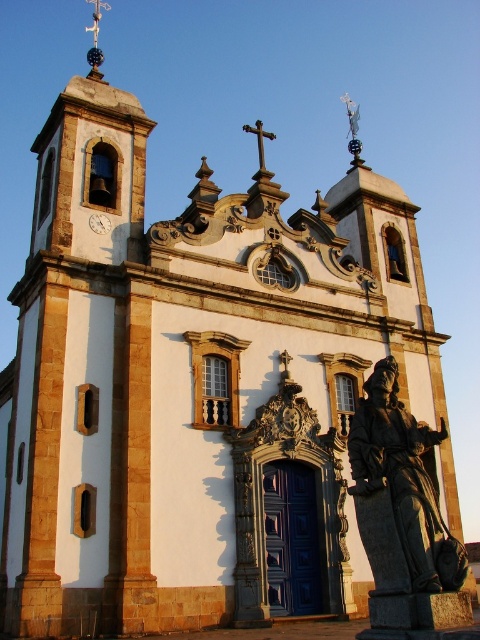
Which is above, bronze statue at center or metallic clock at center?

metallic clock at center is above.

Which is more to the right, bronze statue at center or metallic clock at center?

From the viewer's perspective, bronze statue at center appears more on the right side.

Is point (466, 572) closer to viewer compared to point (105, 220)?

That is True.

At what (x,y) coordinates should I click in order to perform the action: click on bronze statue at center. Please return your answer as a coordinate pair (x, y). Looking at the image, I should click on (402, 490).